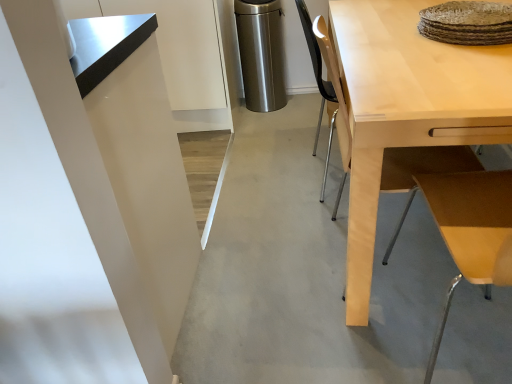
The width and height of the screenshot is (512, 384). I want to click on free space to the right of stainless steel trash can at center, so click(x=302, y=106).